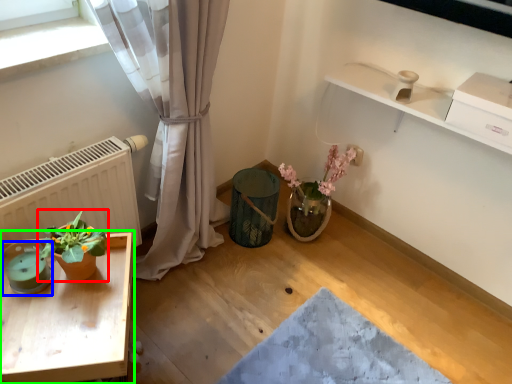
Question: Which object is positioned closest to houseplant (highlighted by a red box)? Select from teal (highlighted by a blue box) and table (highlighted by a green box).

Choices:
 (A) teal
 (B) table

Answer: (A)